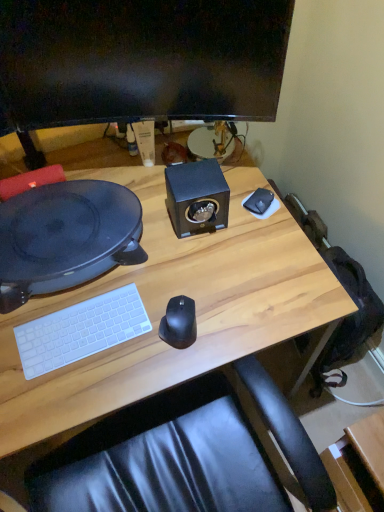
Identify the location of free space to the back side of black matte mouse at center. The image size is (384, 512). (182, 270).